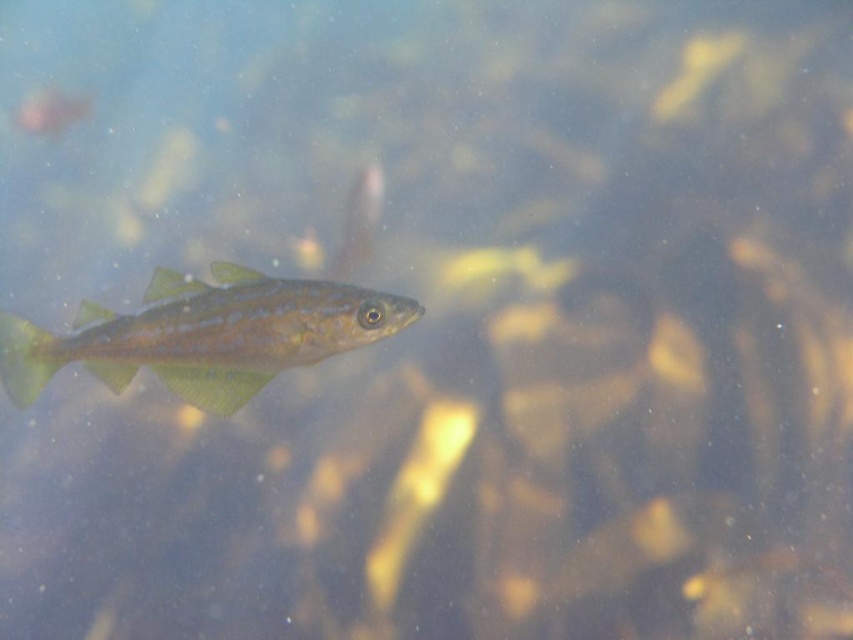
You are a diver with a 1.5 meter long tool. You need to reach the point at coordinates point (22, 339). Can your tool reach that point from your current position?

The point at point (22, 339) is 1.42 meters away from you. Since your tool is 1.5 meters long, it can reach the point.

You are an underwater photographer aiming to capture the green translucent fish at center. Your camera is set to focus at point coordinates of 0.5, 0.25. Will your camera focus on the fish?

The green translucent fish at center is located at point coordinates of (204, 336), which is very close to the camera focus point of (212, 320). Therefore, the camera will likely focus on the fish.